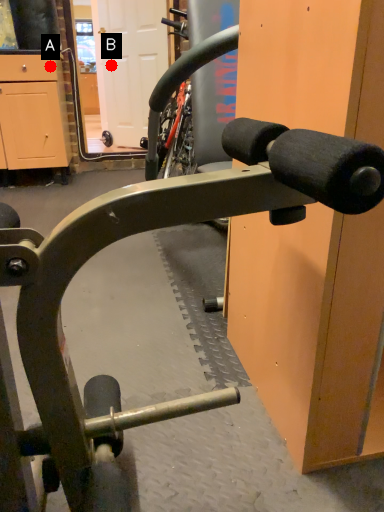
Question: Two points are circled on the image, labeled by A and B beside each circle. Which point appears closest to the camera in this image?

Choices:
 (A) A is closer
 (B) B is closer

Answer: (A)